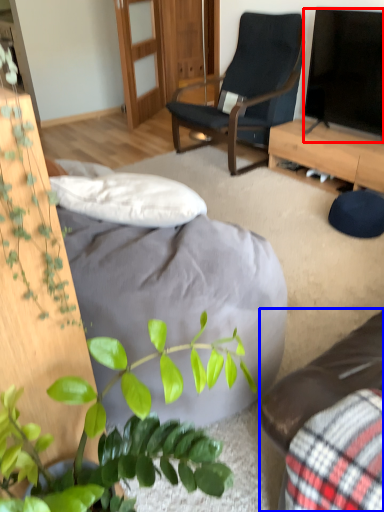
Question: Among these objects, which one is nearest to the camera, television (highlighted by a red box) or studio couch (highlighted by a blue box)?

Choices:
 (A) television
 (B) studio couch

Answer: (B)